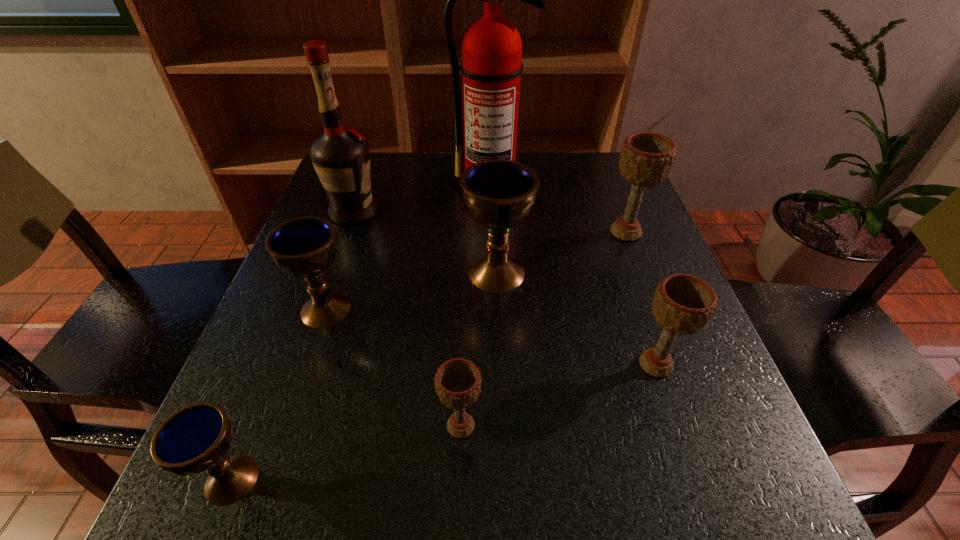
At what (x,y) coordinates should I click in order to perform the action: click on the nearest blue chalice. Please return your answer as a coordinate pair (x, y). This screenshot has height=540, width=960. Looking at the image, I should click on (196, 438).

You are a GUI agent. You are given a task and a screenshot of the screen. Output one action in this format:
    pyautogui.click(x=<x>, y=<y>)
    Task: Click on the nearest chalice
    
    Given the screenshot: What is the action you would take?
    pyautogui.click(x=196, y=438)

Where is `free region located on the side of the fire extinguisher near the handle`? The height and width of the screenshot is (540, 960). free region located on the side of the fire extinguisher near the handle is located at coordinates (493, 265).

I want to click on free space located 0.080m on the front and back of the second tallest object, so click(413, 213).

Where is `free point located 0.300m on the back of the farthest chalice`? free point located 0.300m on the back of the farthest chalice is located at coordinates [x=597, y=157].

The width and height of the screenshot is (960, 540). In order to click on blank area located on the front of the rightmost blue chalice in this screenshot , I will do `click(500, 370)`.

I want to click on vacant point located on the right of the second smallest blue chalice, so click(x=559, y=309).

The height and width of the screenshot is (540, 960). In order to click on vacant point located on the left of the second farthest beige chalice in this screenshot , I will do `click(456, 364)`.

You are a GUI agent. You are given a task and a screenshot of the screen. Output one action in this format:
    pyautogui.click(x=<x>, y=<y>)
    Task: Click on the free space located on the left of the second nearest chalice
    Image resolution: width=960 pixels, height=540 pixels.
    Given the screenshot: What is the action you would take?
    pyautogui.click(x=362, y=426)

The image size is (960, 540). I want to click on vacant region located 0.270m on the back of the nearest object, so click(298, 312).